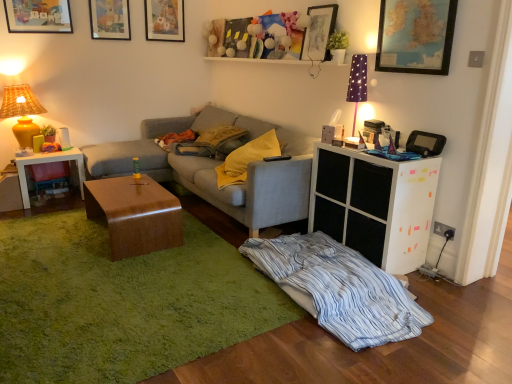
Locate an element on the screen. The width and height of the screenshot is (512, 384). free point above green shaggy rug at center (from a real-world perspective) is located at coordinates (112, 265).